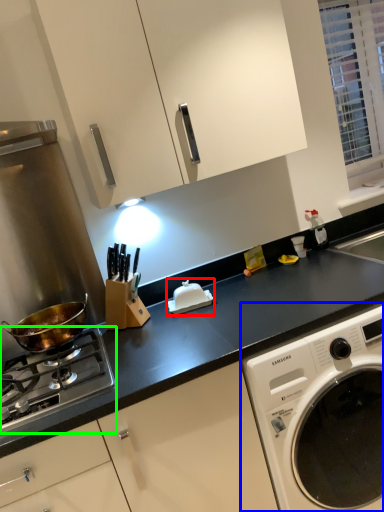
Question: Which object is the farthest from appliance (highlighted by a red box)? Choose among these: washing machine (highlighted by a blue box) or gas stove (highlighted by a green box).

Choices:
 (A) washing machine
 (B) gas stove

Answer: (A)